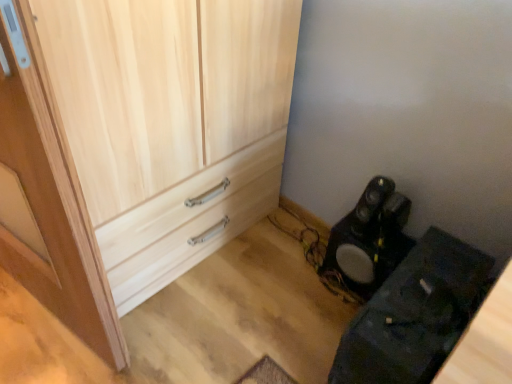
Image resolution: width=512 pixels, height=384 pixels. I want to click on blank space above black matte speaker at lower right (from a real-world perspective), so click(378, 243).